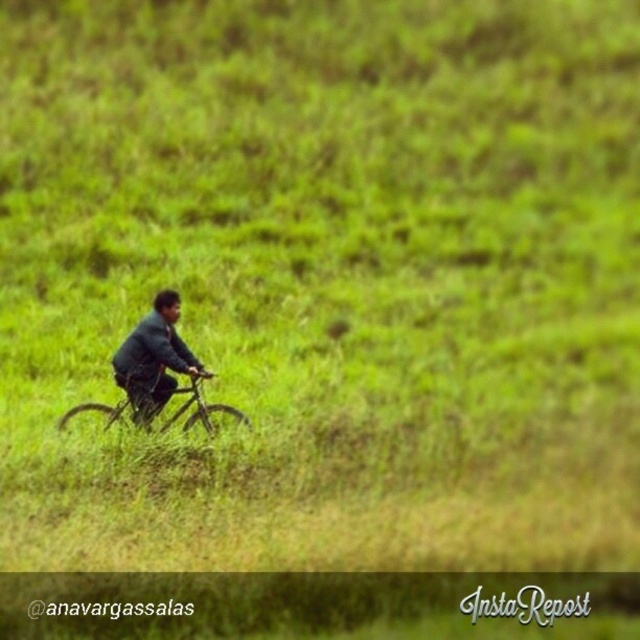
Is dark blue fabric jacket at center bigger than metallic silver mountain bike at center?

No.

Between dark blue fabric jacket at center and metallic silver mountain bike at center, which one has less height?

metallic silver mountain bike at center

Is point (148, 381) behind point (176, 416)?

No, it is in front of (176, 416).

This screenshot has height=640, width=640. Find the location of `dark blue fabric jacket at center`. dark blue fabric jacket at center is located at coordinates (154, 358).